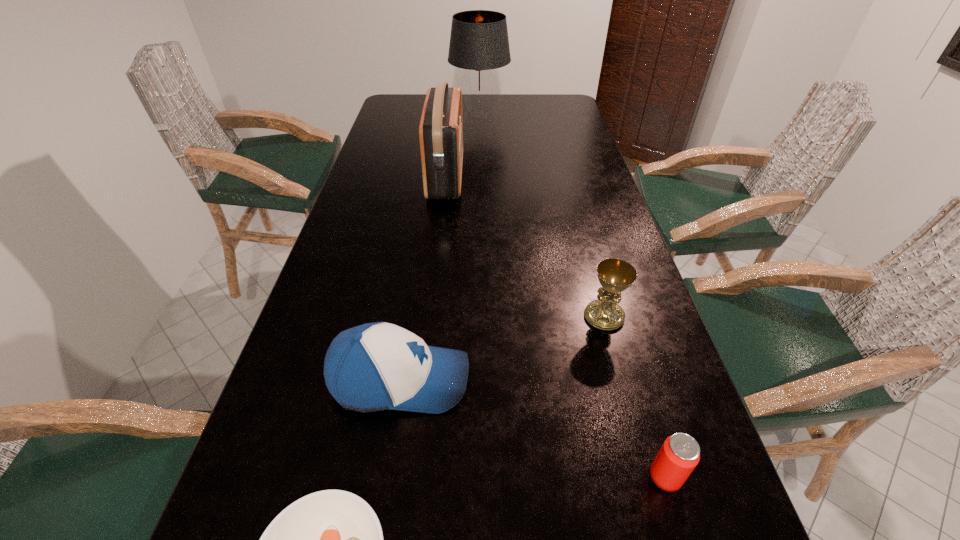
I want to click on lampshade, so click(x=479, y=44).

This screenshot has width=960, height=540. In order to click on the tallest object in this screenshot , I will do `click(479, 44)`.

You are a GUI agent. You are given a task and a screenshot of the screen. Output one action in this format:
    pyautogui.click(x=<x>, y=<y>)
    Task: Click on the second farthest object
    The height and width of the screenshot is (540, 960).
    Given the screenshot: What is the action you would take?
    pyautogui.click(x=441, y=127)

At what (x,y) coordinates should I click in order to perform the action: click on the second tallest object. Please return your answer as a coordinate pair (x, y). Looking at the image, I should click on (441, 127).

The height and width of the screenshot is (540, 960). In order to click on baseball cap in this screenshot , I will do `click(377, 366)`.

The width and height of the screenshot is (960, 540). What are the coordinates of `chalice` in the screenshot? It's located at (615, 275).

The image size is (960, 540). Identify the location of beer can. (679, 455).

This screenshot has height=540, width=960. I want to click on the second shortest object, so click(x=679, y=455).

You are a GUI agent. You are given a task and a screenshot of the screen. Output one action in this format:
    pyautogui.click(x=<x>, y=<y>)
    Task: Click on the vacant region located 0.070m on the right of the lampshade
    The height and width of the screenshot is (540, 960).
    Given the screenshot: What is the action you would take?
    pyautogui.click(x=527, y=114)

Find the location of `free spot located 0.160m on the front-facing side of the second farthest object`. free spot located 0.160m on the front-facing side of the second farthest object is located at coordinates (514, 177).